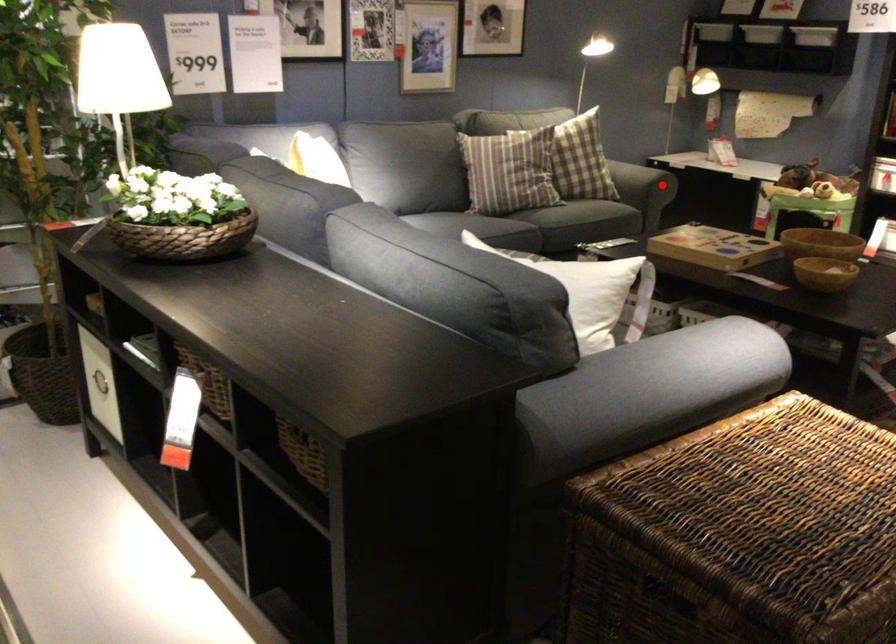
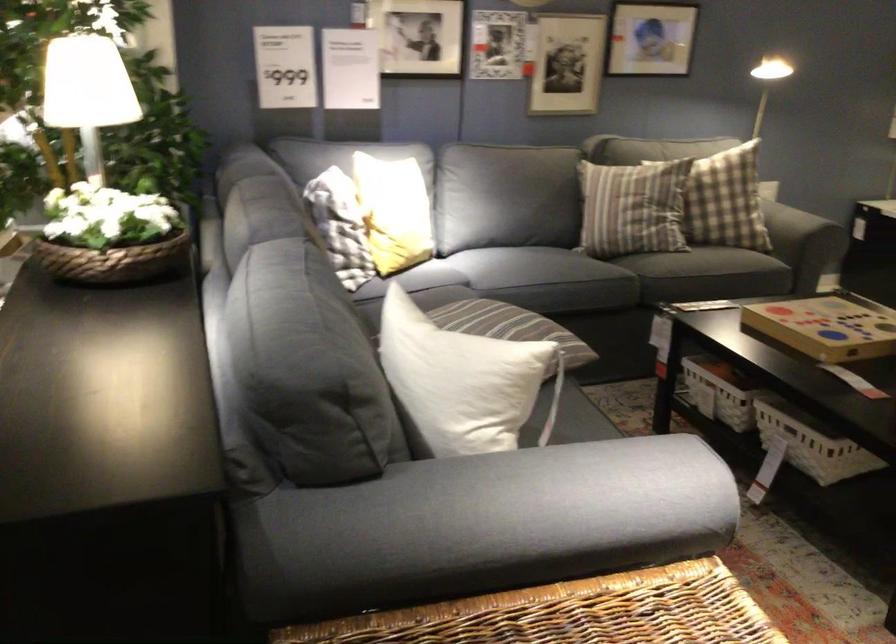
Where in the second image is the point corresponding to the highlighted location from the first image?

(798, 223)